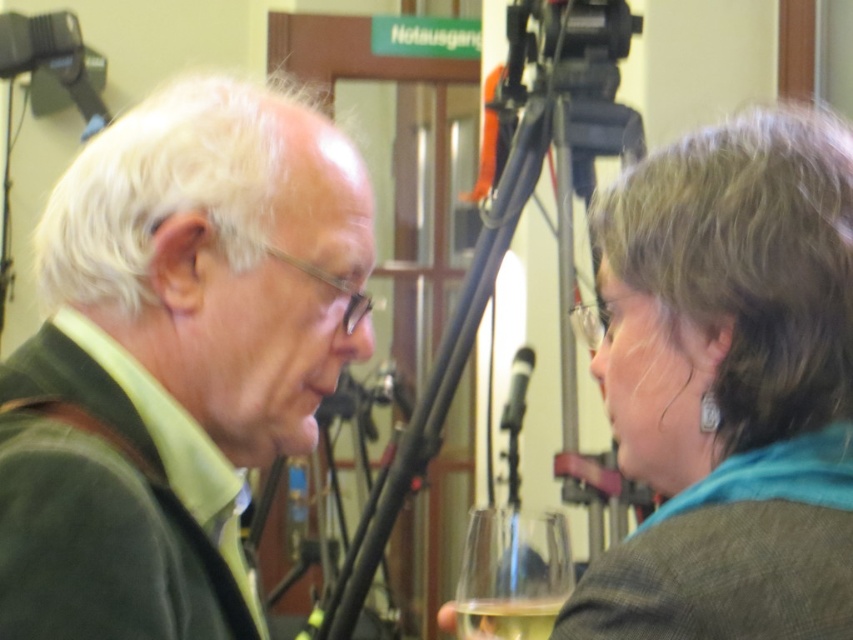
Question: Estimate the real-world distances between objects in this image. Which object is farther from the clear glass wine glass at lower center?

Choices:
 (A) black metal tripod at center
 (B) gray wool scarf at upper right
 (C) black matte microphone at center
 (D) translucent glass at lower center

Answer: (C)

Question: Among these points, which one is nearest to the camera?

Choices:
 (A) (531, 536)
 (B) (93, 308)
 (C) (515, 422)
 (D) (567, 120)

Answer: (B)

Question: Does clear glass wine glass at lower center have a lesser width compared to translucent glass at lower center?

Choices:
 (A) no
 (B) yes

Answer: (A)

Question: Which of these objects is positioned closest to the green matte sweater at left?

Choices:
 (A) gray wool scarf at upper right
 (B) translucent glass at lower center
 (C) clear glass wine glass at lower center
 (D) black metal tripod at center

Answer: (C)

Question: Can you confirm if translucent glass at lower center is positioned to the right of black matte microphone at center?

Choices:
 (A) no
 (B) yes

Answer: (A)

Question: Does clear glass wine glass at lower center appear on the left side of black matte microphone at center?

Choices:
 (A) no
 (B) yes

Answer: (B)